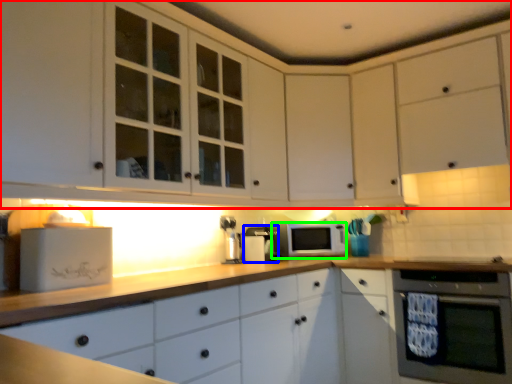
Question: Which object is the closest to the cabinetry (highlighted by a red box)? Choose among these: coffee machine (highlighted by a blue box) or microwave oven (highlighted by a green box).

Choices:
 (A) coffee machine
 (B) microwave oven

Answer: (B)